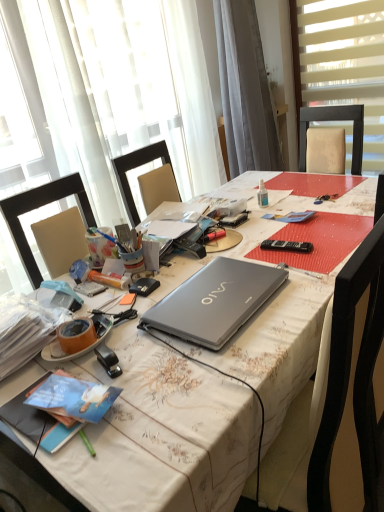
At what (x,y) coordinates should I click in order to perform the action: click on free area in between silver metallic laptop at center and blue paperback book at lower left, the 2th book positioned from the bottom. Please return your answer as a coordinate pair (x, y). Looking at the image, I should click on (142, 364).